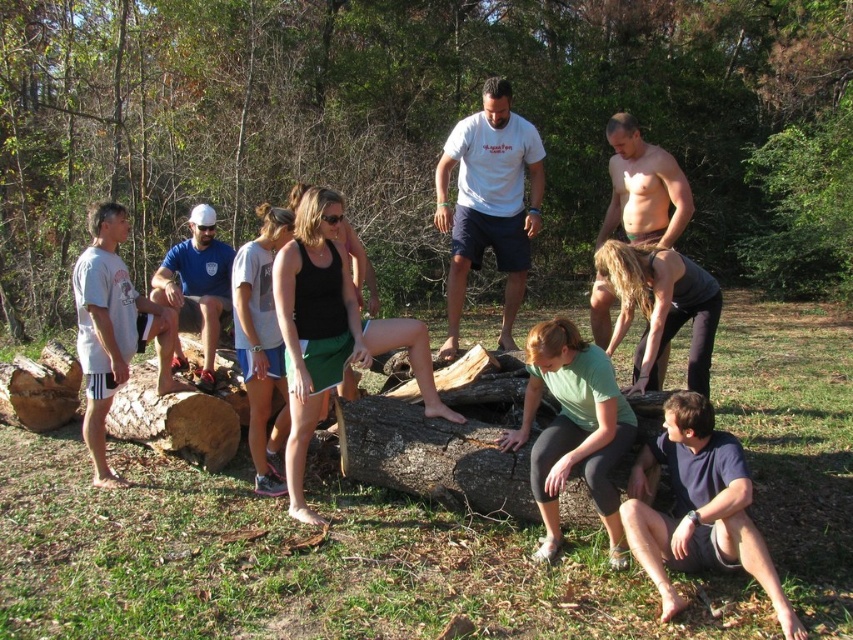
Between dark blue fabric squat at lower right and white matte shorts at left, which one has less height?

Standing shorter between the two is dark blue fabric squat at lower right.

What do you see at coordinates (699, 508) in the screenshot?
I see `dark blue fabric squat at lower right` at bounding box center [699, 508].

Does point (660, 564) come farther from viewer compared to point (94, 240)?

No, (660, 564) is closer to viewer.

Where is `dark blue fabric squat at lower right`? Image resolution: width=853 pixels, height=640 pixels. dark blue fabric squat at lower right is located at coordinates (699, 508).

Measure the distance between brown wood log at center and camera.

brown wood log at center and camera are 6.30 meters apart.

Is point (285, 152) behind point (543, 429)?

That is True.

Locate an element on the screen. Image resolution: width=853 pixels, height=640 pixels. brown wood log at center is located at coordinates (421, 128).

Is point (492, 460) positioned behind point (202, 289)?

That is False.

Is brown rough tree trunk at center to the right of matte blue shirt at center from the viewer's perspective?

Yes, brown rough tree trunk at center is to the right of matte blue shirt at center.

Describe the element at coordinates (433, 456) in the screenshot. I see `brown rough tree trunk at center` at that location.

Locate an element on the screen. brown rough tree trunk at center is located at coordinates (433, 456).